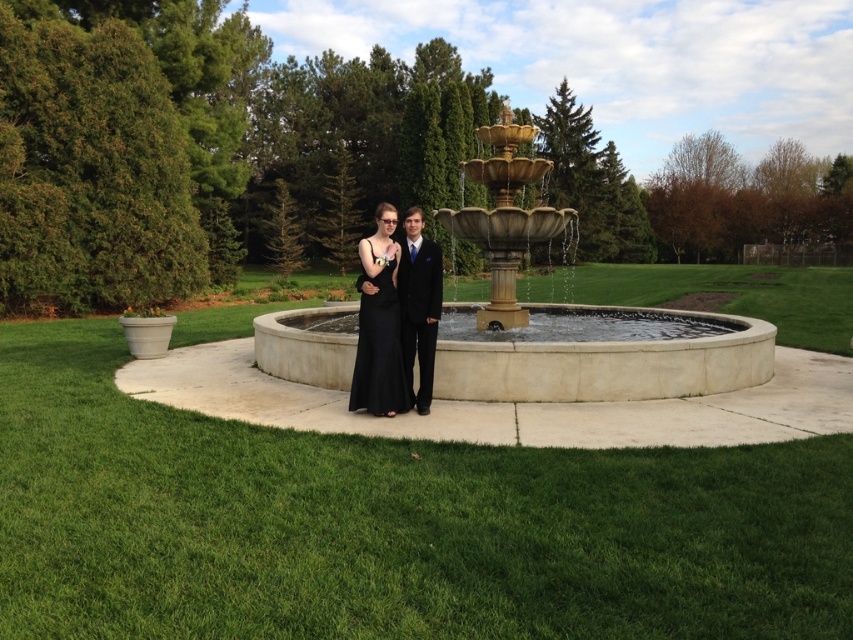
Question: Does gold polished stone fountain at center appear over black satin dress at center?

Choices:
 (A) yes
 (B) no

Answer: (A)

Question: Can you confirm if shiny black suit at center is wider than black satin dress at center?

Choices:
 (A) yes
 (B) no

Answer: (B)

Question: Based on their relative distances, which object is nearer to the gold polished stone fountain at center?

Choices:
 (A) shiny black suit at center
 (B) black satin dress at center

Answer: (B)

Question: Among these objects, which one is nearest to the camera?

Choices:
 (A) shiny black suit at center
 (B) black satin dress at center

Answer: (B)

Question: Is shiny black suit at center further to the viewer compared to black satin dress at center?

Choices:
 (A) yes
 (B) no

Answer: (A)

Question: Considering the real-world distances, which object is farthest from the shiny black suit at center?

Choices:
 (A) gold polished stone fountain at center
 (B) black satin dress at center

Answer: (A)